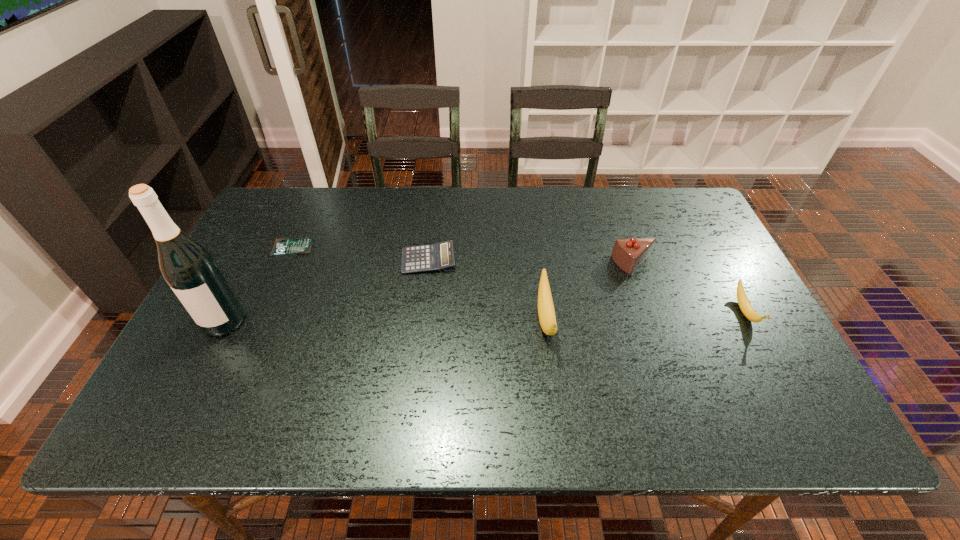
This screenshot has width=960, height=540. I want to click on vacant space located 0.070m on the front of the calculator, so click(424, 294).

You are a GUI agent. You are given a task and a screenshot of the screen. Output one action in this format:
    pyautogui.click(x=<x>, y=<y>)
    Task: Click on the vacant area situated on the front of the identity card
    Image resolution: width=960 pixels, height=540 pixels.
    Given the screenshot: What is the action you would take?
    pyautogui.click(x=259, y=323)

Locate an element on the screen. free region located on the left of the fifth object from left to right is located at coordinates (536, 265).

The height and width of the screenshot is (540, 960). Find the location of `identity card positioned at the left edge`. identity card positioned at the left edge is located at coordinates pos(281,246).

The width and height of the screenshot is (960, 540). What are the coordinates of `wine bottle that is at the left edge` in the screenshot? It's located at (190, 270).

Find the location of a particular element. object situated at the right edge is located at coordinates (743, 302).

In the image, there is a desktop. At what (x,y) coordinates should I click in order to perform the action: click on vacant space at the far edge. Please return your answer as a coordinate pair (x, y). This screenshot has width=960, height=540. Looking at the image, I should click on (631, 188).

You are a GUI agent. You are given a task and a screenshot of the screen. Output one action in this format:
    pyautogui.click(x=<x>, y=<y>)
    Task: Click on the blank space at the near edge
    This screenshot has height=540, width=960.
    Given the screenshot: What is the action you would take?
    pyautogui.click(x=253, y=361)

Find the location of a particular element. This screenshot has width=960, height=540. blank area at the left edge is located at coordinates (250, 305).

At what (x,y) coordinates should I click in order to perform the action: click on free space at the right edge of the desktop. Please return your answer as a coordinate pair (x, y). This screenshot has height=540, width=960. Looking at the image, I should click on (689, 274).